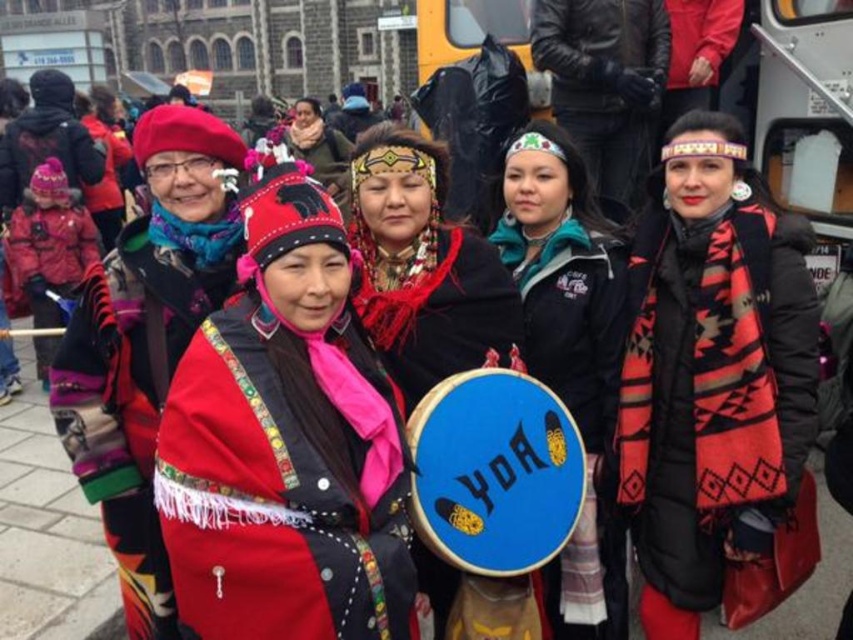
Can you confirm if matte red blanket at center is thinner than teal fabric jacket at center?

In fact, matte red blanket at center might be wider than teal fabric jacket at center.

Between matte red blanket at center and teal fabric jacket at center, which one is positioned lower?

matte red blanket at center is below.

Who is more forward, [444,323] or [566,140]?

Point [444,323] is more forward.

At what (x,y) coordinates should I click in order to perform the action: click on matte red blanket at center. Please return your answer as a coordinate pair (x, y). This screenshot has width=853, height=640. Looking at the image, I should click on [424, 268].

Which of these two, matte black coat at center or matte pink snowsuit at left, stands shorter?

matte pink snowsuit at left

Based on the photo, is matte black coat at center wider than matte pink snowsuit at left?

Yes.

Is point (112, 516) farther from viewer compared to point (82, 273)?

That is False.

Identify the location of matte black coat at center. Image resolution: width=853 pixels, height=640 pixels. (146, 340).

Who is positioned more to the right, red and black woven scarf at center or matte red blanket at center?

red and black woven scarf at center is more to the right.

Can you confirm if red and black woven scarf at center is positioned above matte red blanket at center?

Yes, red and black woven scarf at center is above matte red blanket at center.

At what (x,y) coordinates should I click in order to perform the action: click on red and black woven scarf at center. Please return your answer as a coordinate pair (x, y). The width and height of the screenshot is (853, 640). Looking at the image, I should click on (712, 374).